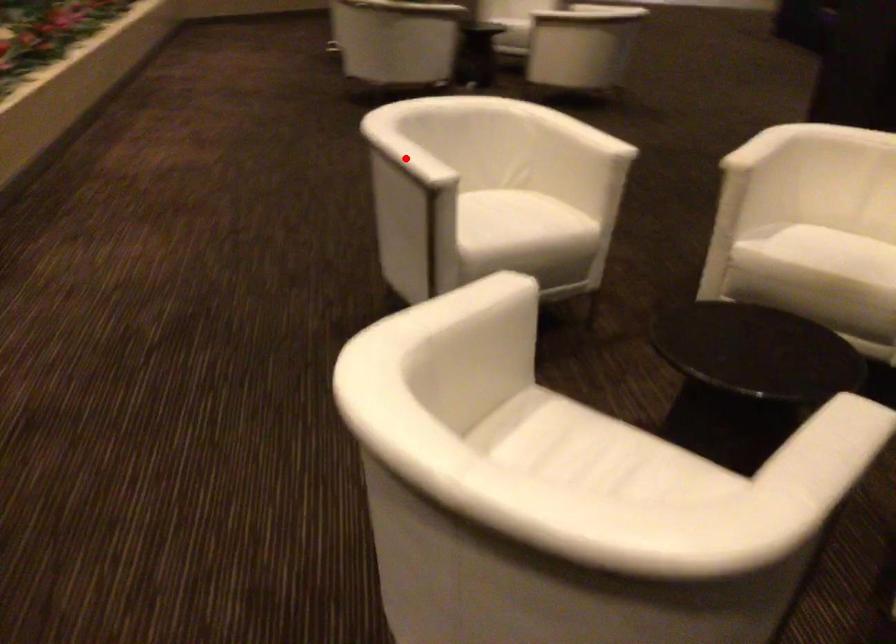
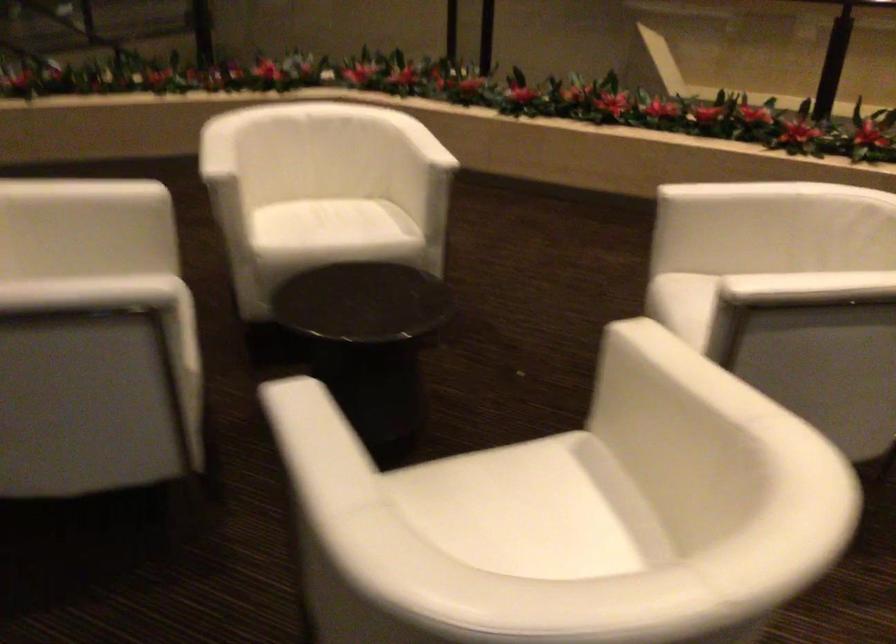
Question: I am providing you with two images of the same scene from different viewpoints. A red point is marked on the first image. At the location where the point appears in image 1, is it still visible in image 2?

Choices:
 (A) Yes
 (B) No

Answer: (B)